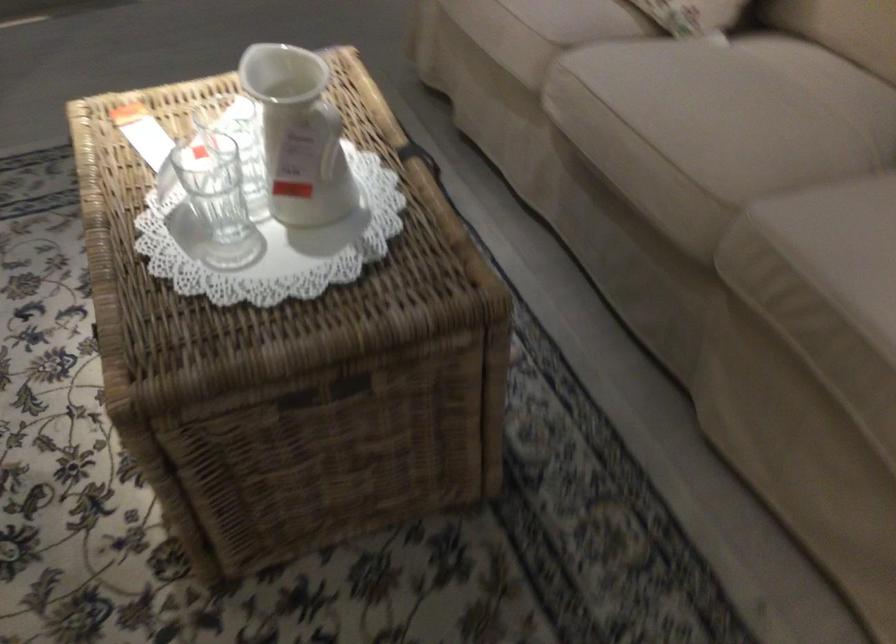
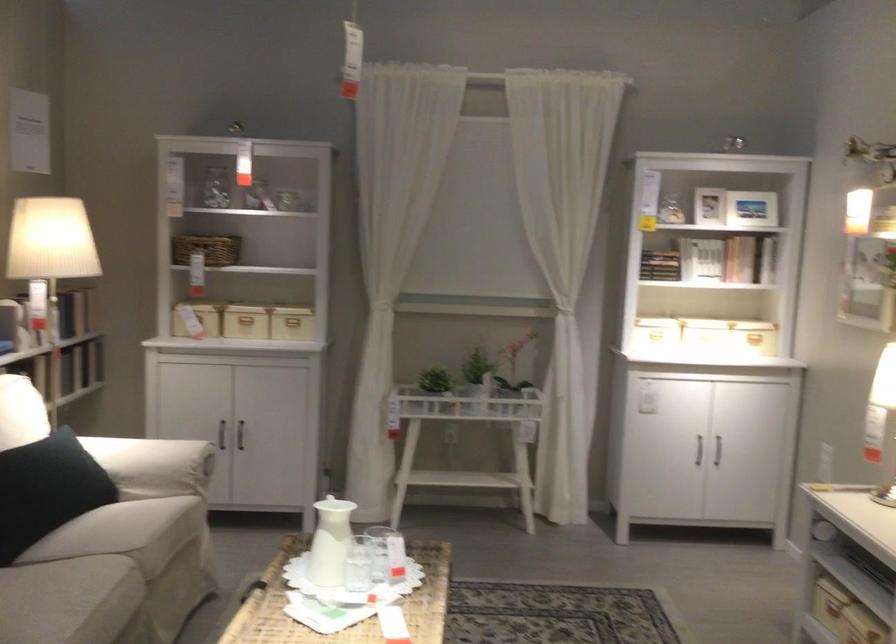
Find the pixel in the second image that matches point 306,129 in the first image.

(330, 542)